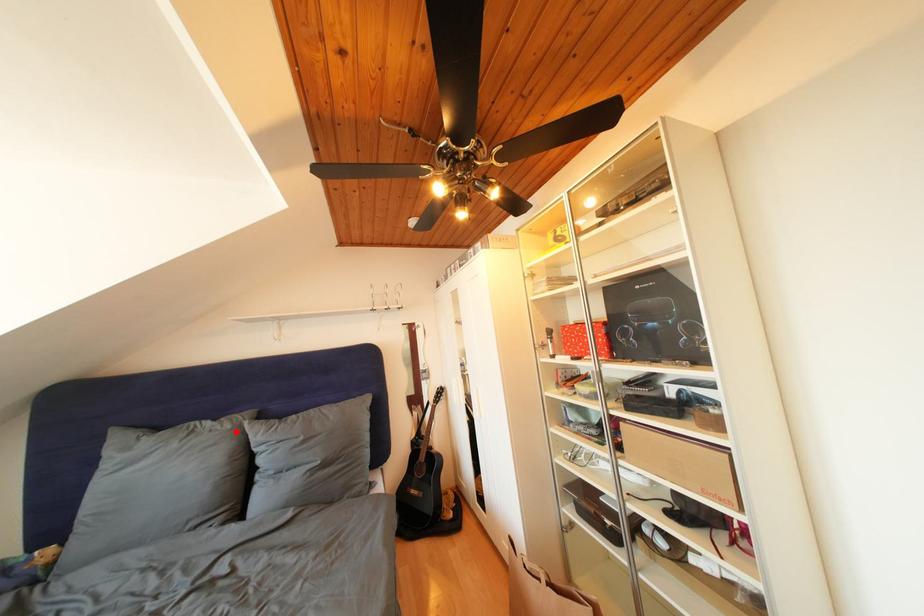
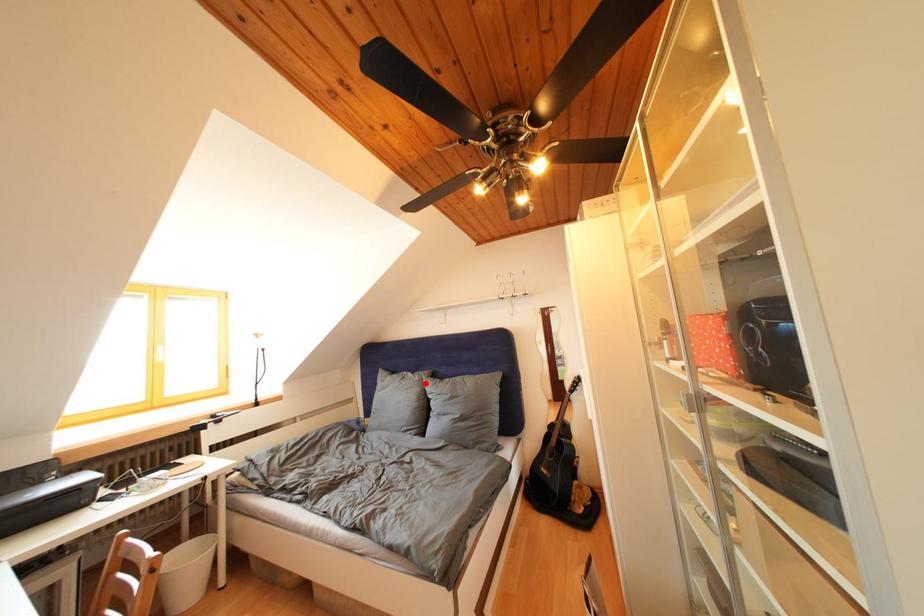
I am providing you with two images of the same scene from different viewpoints. A red point is marked on the first image and another point is marked on the second image. Does the point marked in image1 correspond to the same location as the one in image2?

Yes